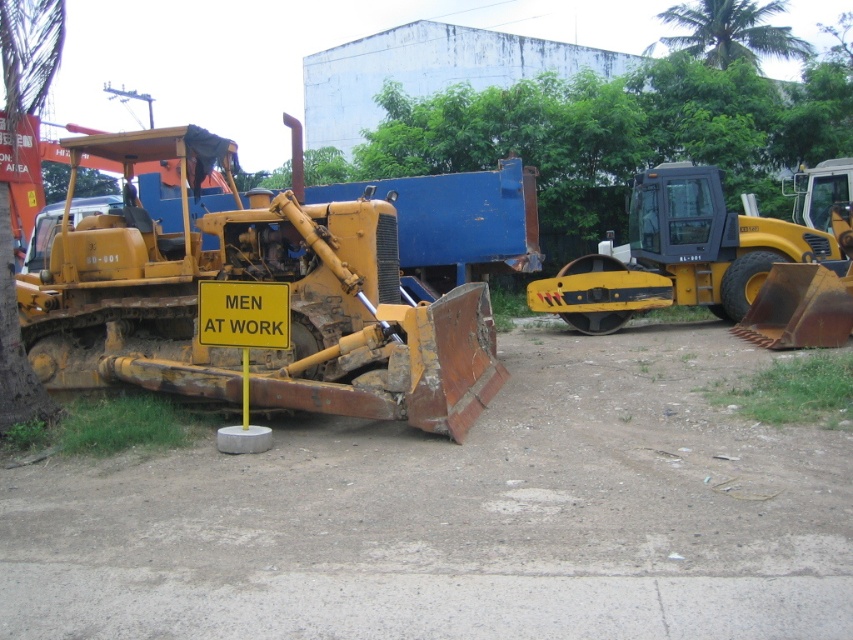
Consider the image. Is yellow rubber roller at right above green leafy tree at upper center?

No.

Measure the distance between yellow rubber roller at right and camera.

They are 46.75 feet apart.

Is point (697, 170) in front of point (755, 10)?

Yes.

You are a GUI agent. You are given a task and a screenshot of the screen. Output one action in this format:
    pyautogui.click(x=<x>, y=<y>)
    Task: Click on the yellow rubber roller at right
    The image size is (853, 640).
    Given the screenshot: What is the action you would take?
    pyautogui.click(x=676, y=253)

Is dirt track at center bigger than yellow rubber roller at right?

No.

Which is behind, point (282, 516) or point (674, 288)?

The point (674, 288) is behind.

Who is more forward, (602, 337) or (646, 248)?

Point (602, 337) is more forward.

This screenshot has width=853, height=640. I want to click on dirt track at center, so click(x=460, y=516).

Is yellow metallic tractor at left further to camera compared to green leafy tree at upper center?

No, it is in front of green leafy tree at upper center.

Is yellow metallic tractor at left bigger than green leafy tree at upper center?

No, yellow metallic tractor at left is not bigger than green leafy tree at upper center.

Who is more distant from viewer, (265, 221) or (699, 35)?

The point (699, 35) is more distant.

Identify the location of yellow metallic tractor at left. (258, 280).